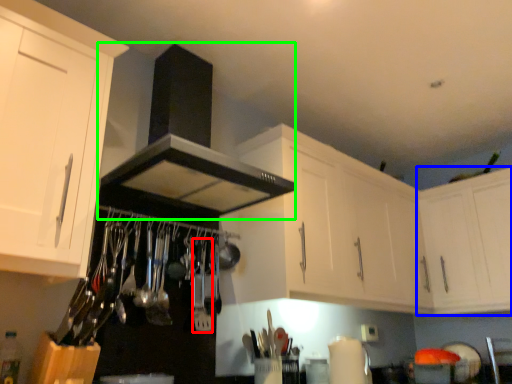
Question: Which object is positioned closest to silverware (highlighted by a red box)? Select from cabinetry (highlighted by a blue box) and exhaust hood (highlighted by a green box).

Choices:
 (A) cabinetry
 (B) exhaust hood

Answer: (B)